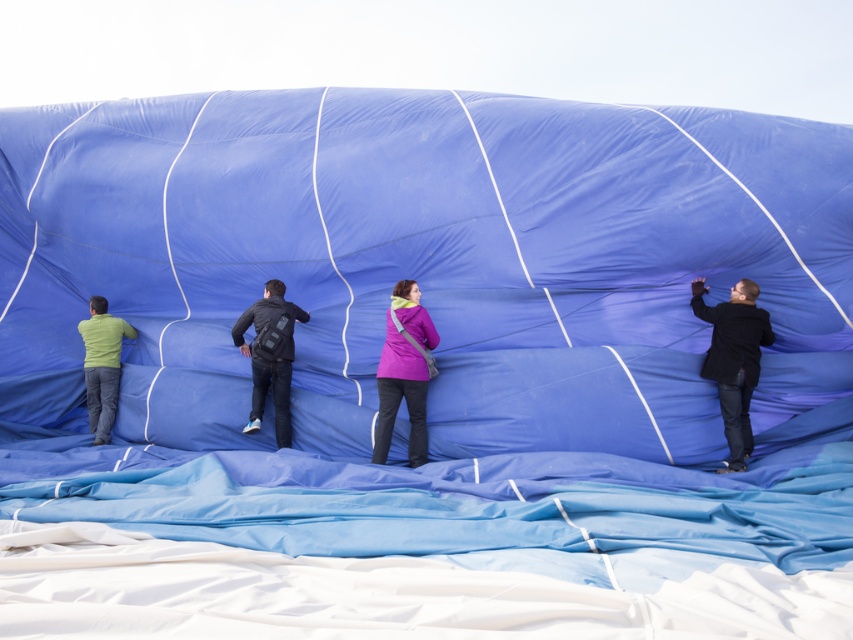
Question: Which of the following is the farthest from the observer?

Choices:
 (A) (287, 305)
 (B) (88, 337)
 (C) (724, 369)

Answer: (B)

Question: Estimate the real-world distances between objects in this image. Which object is farther from the dark blue fabric at right?

Choices:
 (A) purple matte jacket at center
 (B) dark blue fabric at center
 (C) matte green shirt at left

Answer: (C)

Question: Is dark blue fabric at right thinner than dark blue fabric at center?

Choices:
 (A) no
 (B) yes

Answer: (B)

Question: Where is purple matte jacket at center located in relation to dark blue fabric at center in the image?

Choices:
 (A) above
 (B) below

Answer: (B)

Question: Which object is farther from the camera taking this photo?

Choices:
 (A) purple matte jacket at center
 (B) dark blue fabric at right

Answer: (A)

Question: Is dark blue fabric at center to the right of matte green shirt at left from the viewer's perspective?

Choices:
 (A) no
 (B) yes

Answer: (B)